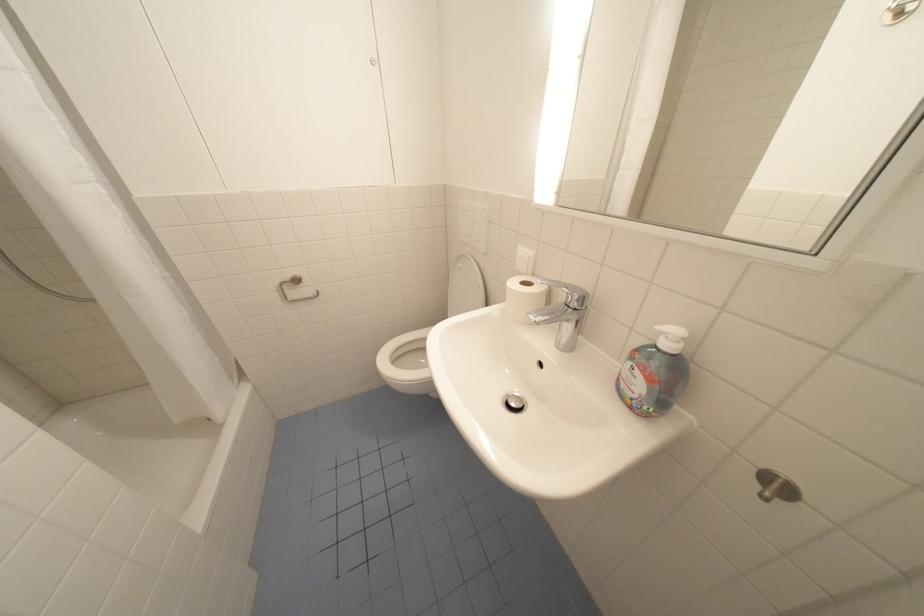
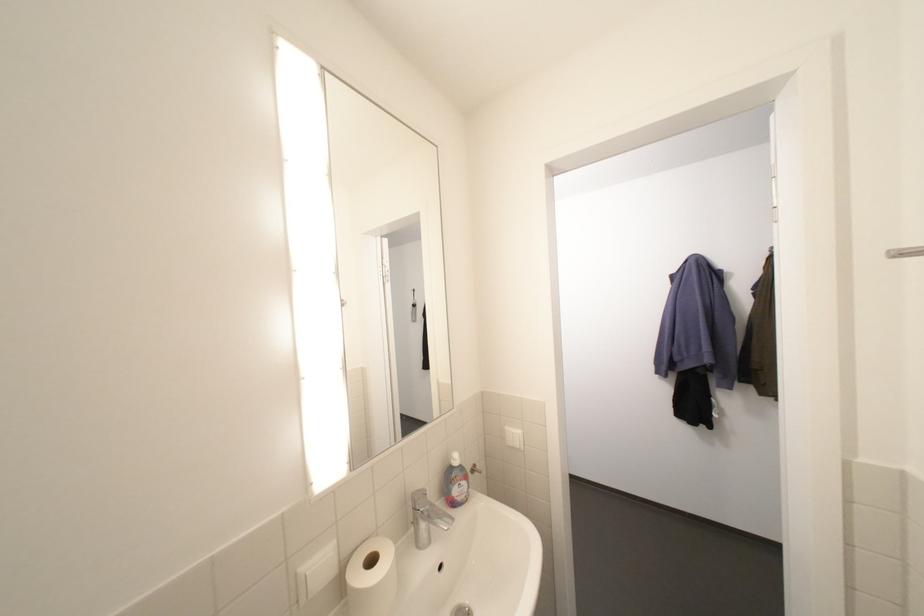
Find the pixel in the second image that matches (629,382) in the first image.

(465, 499)